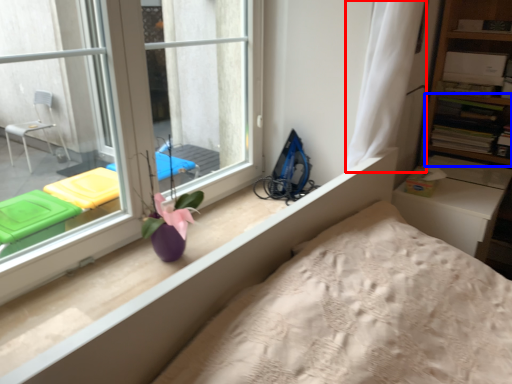
Question: Which object is further to the camera taking this photo, curtain (highlighted by a red box) or shelf (highlighted by a blue box)?

Choices:
 (A) curtain
 (B) shelf

Answer: (B)